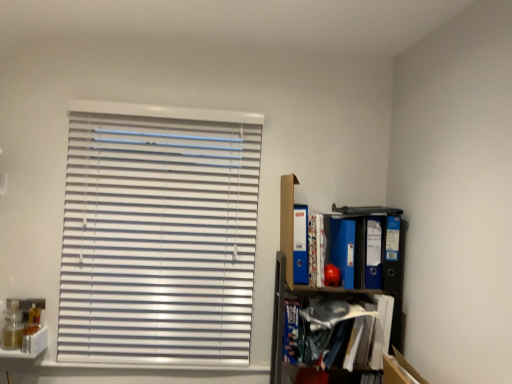
Question: Considering the positions of blue glossy folder at right, the 1th paperback book from the right, and blue matte book at lower right, which appears as the 1th book when ordered from the bottom, in the image, is blue glossy folder at right, the 1th paperback book from the right, wider or thinner than blue matte book at lower right, which appears as the 1th book when ordered from the bottom,?

Choices:
 (A) thin
 (B) wide

Answer: (A)

Question: Does point (394, 253) appear closer or farther from the camera than point (296, 327)?

Choices:
 (A) farther
 (B) closer

Answer: (A)

Question: Which is farther from the blue glossy folder at right, the 4th paperback book from the left?

Choices:
 (A) blue matte folder at right, placed as the 3th paperback book when sorted from left to right
 (B) patterned paper book at upper right, the 1th book from the right
 (C) blue matte book at lower right, which appears as the 1th book when ordered from the bottom
 (D) blue matte folder at upper right, the 1th paperback book when ordered from left to right
 (E) matte blue paperback book at right, which is the second paperback book in left-to-right order

Answer: (C)

Question: Which of these objects is positioned farthest from the matte blue paperback book at right, the 3th paperback book viewed from the right?

Choices:
 (A) blue matte folder at upper right, the 1th paperback book when ordered from left to right
 (B) blue glossy folder at right, the 1th paperback book from the right
 (C) blue matte folder at right, positioned as the 2th paperback book in right-to-left order
 (D) blue matte book at lower right, which is the first book in left-to-right order
 (E) patterned paper book at upper right, the 2th book viewed from the left

Answer: (D)